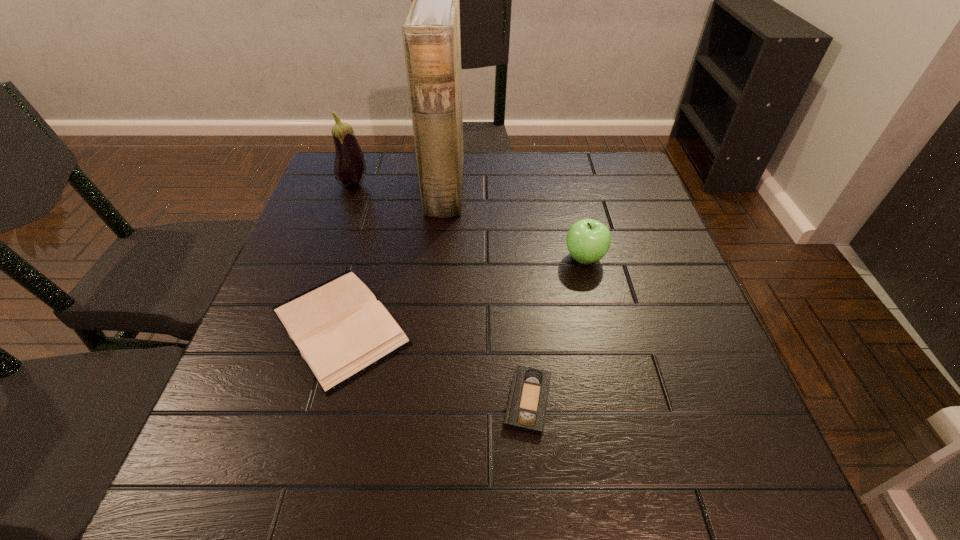
This screenshot has width=960, height=540. In order to click on free point that satisfies the following two spatial constraints: 1. on the cover of the apple; 2. on the right side of the tallest object in this screenshot , I will do `click(438, 258)`.

You are a GUI agent. You are given a task and a screenshot of the screen. Output one action in this format:
    pyautogui.click(x=<x>, y=<y>)
    Task: Click on the free spot that satisfies the following two spatial constraints: 1. on the cover of the tallest object; 2. on the front side of the hardback book
    This screenshot has height=540, width=960.
    Given the screenshot: What is the action you would take?
    pyautogui.click(x=432, y=326)

This screenshot has height=540, width=960. In order to click on vacant region that satisfies the following two spatial constraints: 1. on the cover of the phonebook; 2. on the right side of the second object from right to left in this screenshot , I will do pos(424,401).